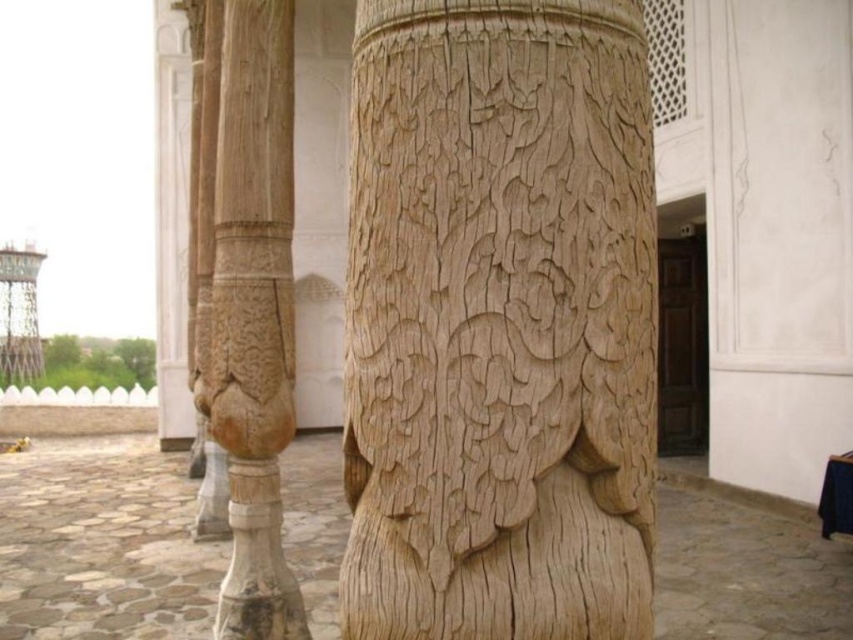
Question: Is natural wood column at center above wooden carved column at center?

Choices:
 (A) yes
 (B) no

Answer: (B)

Question: Considering the relative positions of natural wood column at center and wooden carved column at center in the image provided, where is natural wood column at center located with respect to wooden carved column at center?

Choices:
 (A) right
 (B) left

Answer: (A)

Question: Is natural wood column at center bigger than wooden carved column at center?

Choices:
 (A) no
 (B) yes

Answer: (A)

Question: Which point is closer to the camera?

Choices:
 (A) natural wood column at center
 (B) wooden carved column at center

Answer: (A)

Question: Which object is farther from the camera taking this photo?

Choices:
 (A) natural wood column at center
 (B) wooden carved column at center

Answer: (B)